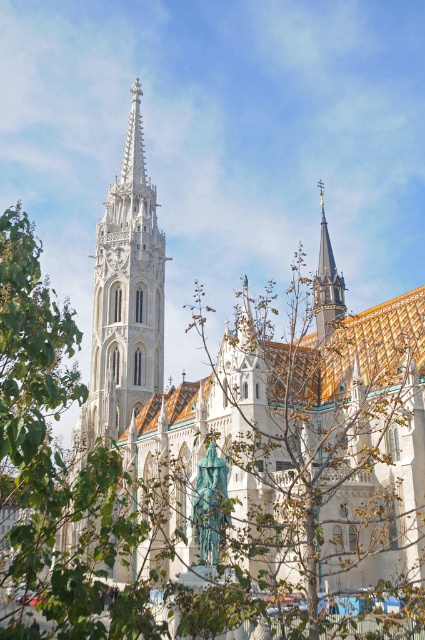
Question: Among these objects, which one is nearest to the camera?

Choices:
 (A) green patinated metal statue at center
 (B) shiny gold spire at upper right
 (C) white stone tower at center

Answer: (A)

Question: Which object is farther from the camera taking this photo?

Choices:
 (A) white stone church at center
 (B) white stone tower at center

Answer: (B)

Question: Does white stone tower at center have a larger size compared to shiny gold spire at upper right?

Choices:
 (A) no
 (B) yes

Answer: (B)

Question: Which object appears farthest from the camera in this image?

Choices:
 (A) shiny gold spire at upper right
 (B) white stone church at center
 (C) green patinated metal statue at center
 (D) white stone tower at center

Answer: (A)

Question: Does white stone tower at center lie in front of shiny gold spire at upper right?

Choices:
 (A) yes
 (B) no

Answer: (A)

Question: From the image, what is the correct spatial relationship of green patinated metal statue at center in relation to shiny gold spire at upper right?

Choices:
 (A) above
 (B) below

Answer: (B)